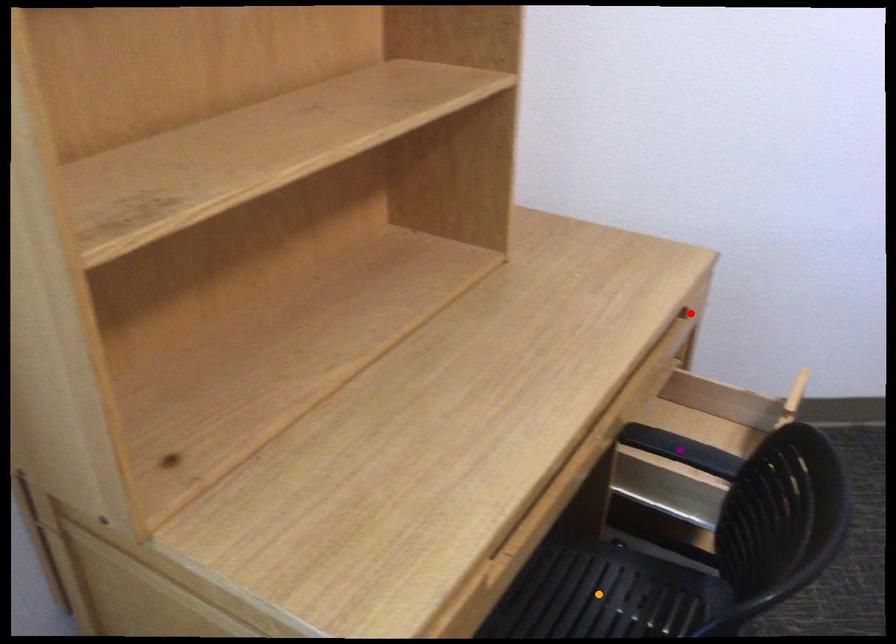
Order these from nearest to farthest:
A) red point
B) purple point
C) orange point

1. purple point
2. red point
3. orange point